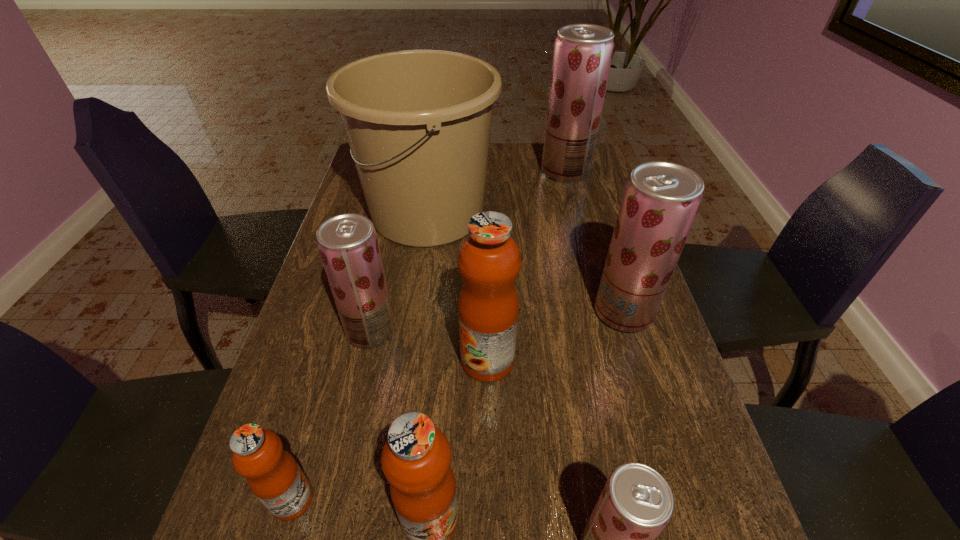
At what (x,y) coordinates should I click in order to perform the action: click on vacant space located 0.170m on the front label of the biggest orange fruit juice. Please return your answer as a coordinate pair (x, y). This screenshot has width=960, height=540. Looking at the image, I should click on (383, 360).

This screenshot has height=540, width=960. I want to click on vacant space located 0.380m on the front label of the biggest orange fruit juice, so click(x=288, y=360).

This screenshot has width=960, height=540. Identify the location of vacant space located 0.240m on the front label of the biggest orange fruit juice. (351, 360).

Find the location of a particular element. The width and height of the screenshot is (960, 540). blank space located 0.340m on the front of the leftmost strawberry fruit juice is located at coordinates (329, 514).

Locate an element on the screen. The height and width of the screenshot is (540, 960). vacant space located on the front label of the leftmost orange fruit juice is located at coordinates (457, 499).

Locate an element on the screen. fruit juice positioned at the far edge is located at coordinates (582, 57).

Where is `bucket at the far edge`? The height and width of the screenshot is (540, 960). bucket at the far edge is located at coordinates (418, 122).

Where is `bucket situated at the left edge`? bucket situated at the left edge is located at coordinates (418, 122).

Locate an element on the screen. This screenshot has height=540, width=960. object present at the far left corner is located at coordinates (418, 122).

At what (x,y) coordinates should I click in order to perform the action: click on object positioned at the far right corner. Please return your answer as a coordinate pair (x, y). This screenshot has width=960, height=540. Looking at the image, I should click on (582, 57).